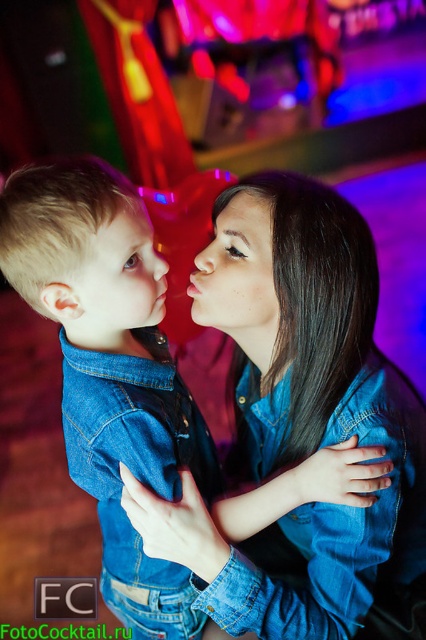
Question: Can you confirm if denim shirt at center is positioned above matte blue denim shirt at center?

Choices:
 (A) yes
 (B) no

Answer: (B)

Question: Which point is farther to the camera?

Choices:
 (A) matte skin at center
 (B) matte blue denim shirt at center
 (C) denim shirt at center
 (D) matte skin forehead at upper center

Answer: (D)

Question: Which point appears closest to the camera in this image?

Choices:
 (A) (189, 294)
 (B) (97, 276)
 (C) (219, 198)
 (D) (11, 225)

Answer: (D)

Question: Is faded denim jacket at lower right thinner than matte skin forehead at upper center?

Choices:
 (A) no
 (B) yes

Answer: (A)

Question: Which point is farther to the camera?

Choices:
 (A) (54, 212)
 (B) (150, 275)

Answer: (B)

Question: Is denim shirt at center above matte blue denim shirt at center?

Choices:
 (A) yes
 (B) no

Answer: (B)